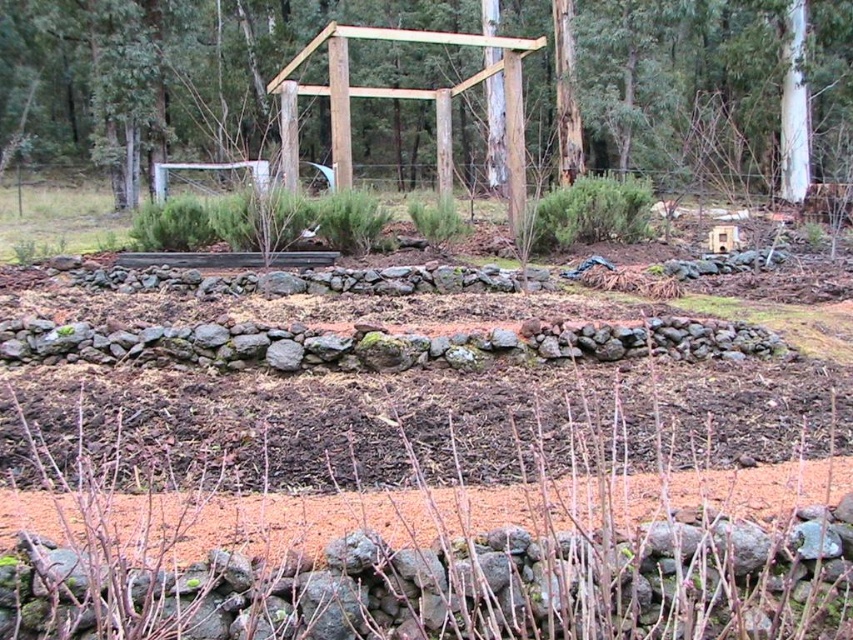
Question: Which of the following is the closest to the observer?

Choices:
 (A) (283, 522)
 (B) (741, 42)

Answer: (A)

Question: Does brown wooden structure at center have a larger size compared to brown soil at center?

Choices:
 (A) no
 (B) yes

Answer: (B)

Question: Which object is closer to the camera taking this photo?

Choices:
 (A) brown wooden structure at center
 (B) brown soil at center

Answer: (B)

Question: Can you confirm if brown wooden structure at center is smaller than brown soil at center?

Choices:
 (A) no
 (B) yes

Answer: (A)

Question: Does brown wooden structure at center have a lesser width compared to brown soil at center?

Choices:
 (A) no
 (B) yes

Answer: (A)